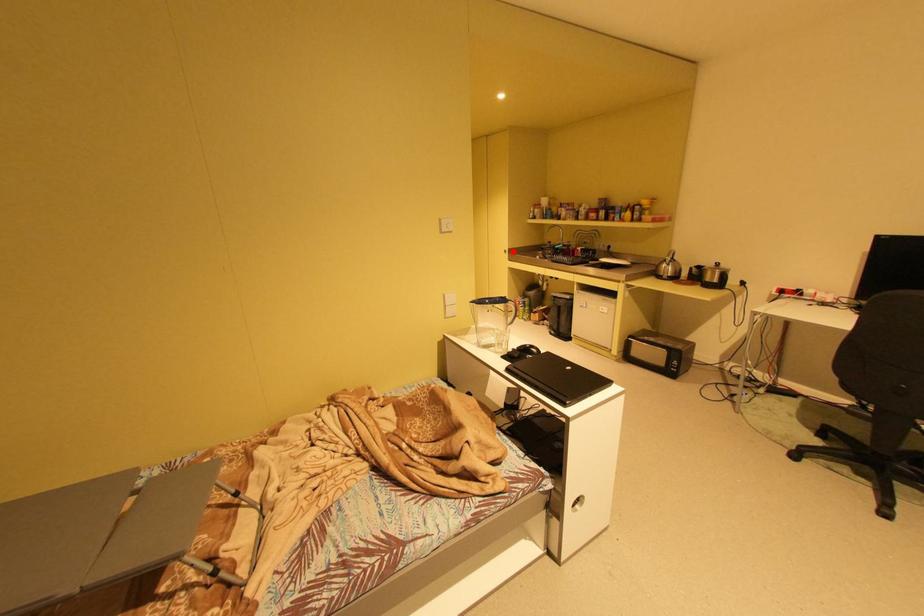
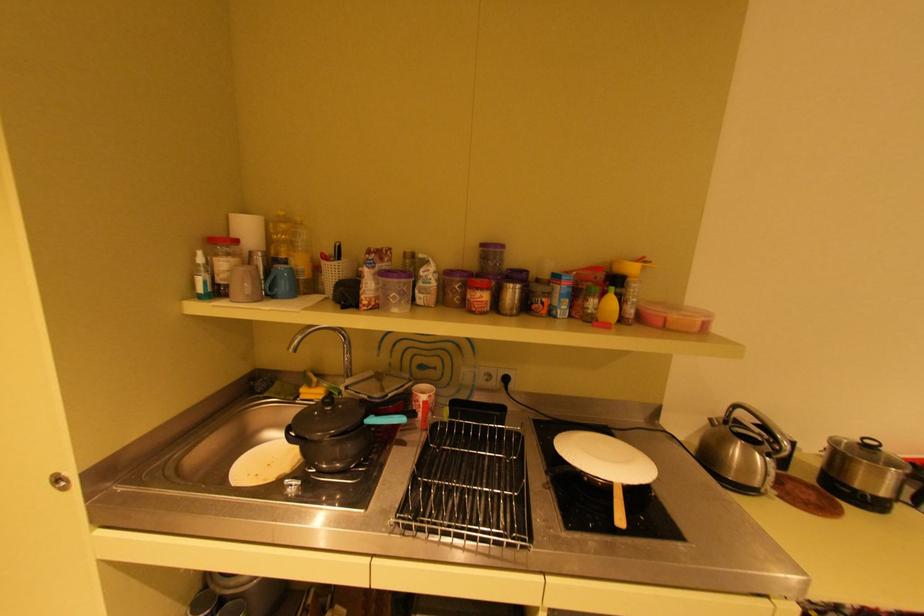
Find the pixel in the second image that matches the highlighted location in the first image.

(65, 479)